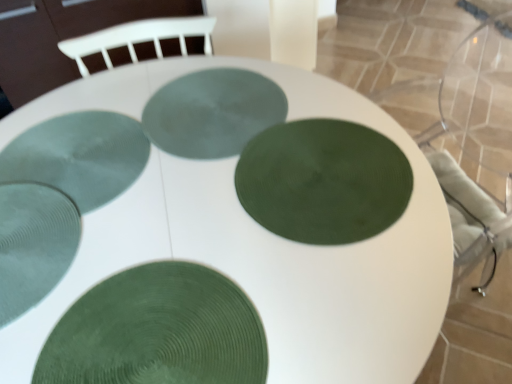
Question: Would you say green textured glass plate at center, arranged as the fourth glass plate when viewed from the front, contains green textured plate at center, which appears as the first glass plate when viewed from the front?

Choices:
 (A) yes
 (B) no

Answer: (B)

Question: Is green textured glass plate at center, positioned as the 2th glass plate in back-to-front order, closer to the viewer compared to green textured plate at center, which appears as the first glass plate when viewed from the front?

Choices:
 (A) no
 (B) yes

Answer: (A)

Question: From a real-world perspective, is green textured glass plate at center, positioned as the 2th glass plate in back-to-front order, positioned under green textured plate at center, which is the 5th glass plate from back to front, based on gravity?

Choices:
 (A) no
 (B) yes

Answer: (B)

Question: Is green textured glass plate at center, positioned as the 2th glass plate in back-to-front order, not near green textured plate at center, which appears as the first glass plate when viewed from the front?

Choices:
 (A) no
 (B) yes

Answer: (A)

Question: From a real-world perspective, is green textured glass plate at center, arranged as the fourth glass plate when viewed from the front, physically above green textured plate at center, which appears as the first glass plate when viewed from the front?

Choices:
 (A) yes
 (B) no

Answer: (B)

Question: From a real-world perspective, relative to green textured glass plate at center, which appears as the 5th glass plate when viewed from the front, is green textured plate at center, which appears as the first glass plate when viewed from the front, vertically above or below?

Choices:
 (A) below
 (B) above

Answer: (B)

Question: Is green textured plate at center, which appears as the first glass plate when viewed from the front, spatially inside green textured glass plate at center, which is the 1th glass plate in back-to-front order, or outside of it?

Choices:
 (A) inside
 (B) outside

Answer: (B)

Question: Is green textured plate at center, which appears as the first glass plate when viewed from the front, wider or thinner than green textured glass plate at center, which is the 1th glass plate in back-to-front order?

Choices:
 (A) thin
 (B) wide

Answer: (A)

Question: From their relative heights in the image, would you say green textured plate at center, which is the 5th glass plate from back to front, is taller or shorter than green textured glass plate at center, which appears as the 5th glass plate when viewed from the front?

Choices:
 (A) short
 (B) tall

Answer: (B)

Question: From the image's perspective, is green textured glass plate at center, which ranks as the third glass plate in front-to-back order, above or below green textured glass plate at center, positioned as the 2th glass plate in back-to-front order?

Choices:
 (A) above
 (B) below

Answer: (B)

Question: Is green textured glass plate at center, positioned as the 3th glass plate in back-to-front order, bigger or smaller than green textured glass plate at center, arranged as the fourth glass plate when viewed from the front?

Choices:
 (A) big
 (B) small

Answer: (B)

Question: Is green textured glass plate at center, which ranks as the third glass plate in front-to-back order, inside or outside of green textured glass plate at center, arranged as the fourth glass plate when viewed from the front?

Choices:
 (A) outside
 (B) inside

Answer: (A)

Question: From their relative heights in the image, would you say green textured glass plate at center, positioned as the 3th glass plate in back-to-front order, is taller or shorter than green textured glass plate at center, arranged as the fourth glass plate when viewed from the front?

Choices:
 (A) short
 (B) tall

Answer: (A)

Question: Which is correct: green textured glass plate at center, positioned as the 2th glass plate in back-to-front order, is inside clear textured glass at bottom left, positioned as the 2th glass plate in front-to-back order, or outside of it?

Choices:
 (A) outside
 (B) inside

Answer: (A)

Question: Relative to clear textured glass at bottom left, the fourth glass plate from the back, is green textured glass plate at center, positioned as the 2th glass plate in back-to-front order, in front or behind?

Choices:
 (A) behind
 (B) front

Answer: (A)